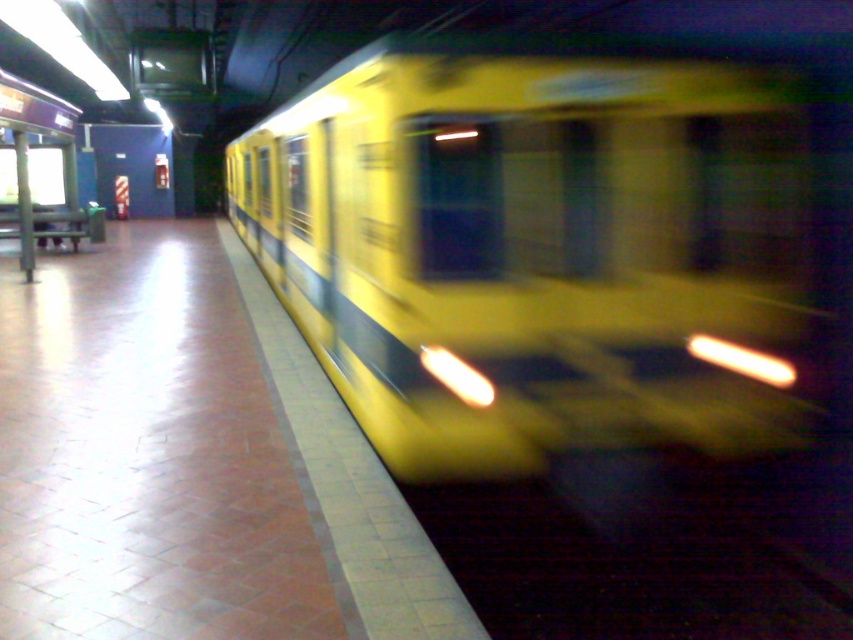
Question: Which object appears farthest from the camera in this image?

Choices:
 (A) dark rubber train track at lower right
 (B) yellow matte train at center

Answer: (B)

Question: Is yellow matte train at center positioned in front of dark rubber train track at lower right?

Choices:
 (A) yes
 (B) no

Answer: (B)

Question: Can you confirm if yellow matte train at center is positioned to the left of dark rubber train track at lower right?

Choices:
 (A) no
 (B) yes

Answer: (B)

Question: Observing the image, what is the correct spatial positioning of yellow matte train at center in reference to dark rubber train track at lower right?

Choices:
 (A) right
 (B) left

Answer: (B)